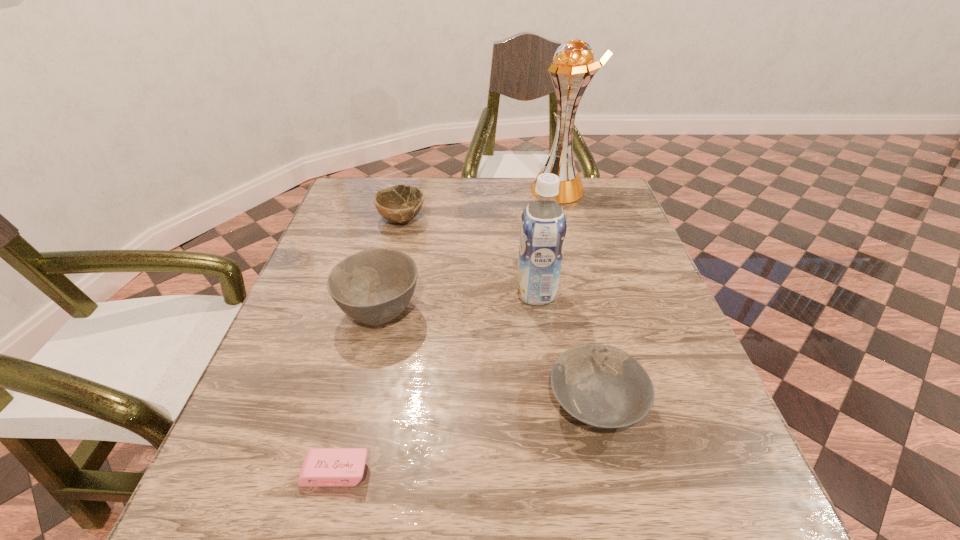
Locate an element on the screen. This screenshot has height=540, width=960. the tallest object is located at coordinates (573, 68).

You are a GUI agent. You are given a task and a screenshot of the screen. Output one action in this format:
    pyautogui.click(x=<x>, y=<y>)
    Task: Click on the farthest object
    
    Given the screenshot: What is the action you would take?
    pyautogui.click(x=573, y=68)

Find the location of `soya milk`. soya milk is located at coordinates (543, 225).

Find the location of a particular element. the third tallest object is located at coordinates (374, 286).

You are a GUI agent. You are given a task and a screenshot of the screen. Output one action in this format:
    pyautogui.click(x=<x>, y=<y>)
    Task: Click on the tallest bowl
    
    Given the screenshot: What is the action you would take?
    pyautogui.click(x=374, y=286)

Locate an element on the screen. This screenshot has height=540, width=960. the farthest bowl is located at coordinates (400, 203).

I want to click on the nearest bowl, so click(x=602, y=386).

Locate an element on the screen. the fifth farthest object is located at coordinates (602, 386).

Where is `eraser`? The width and height of the screenshot is (960, 540). eraser is located at coordinates (323, 467).

Find the location of `the shortest object`. the shortest object is located at coordinates (323, 467).